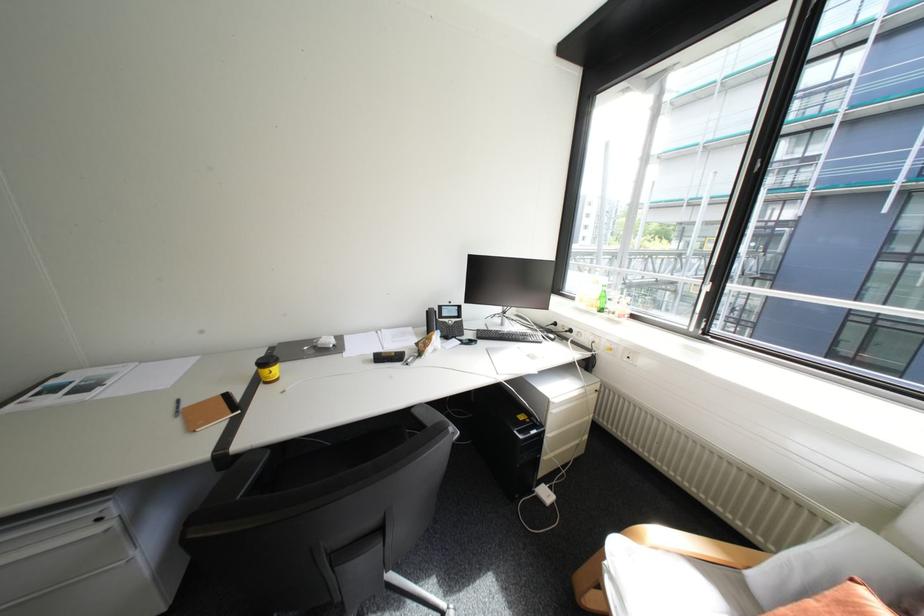
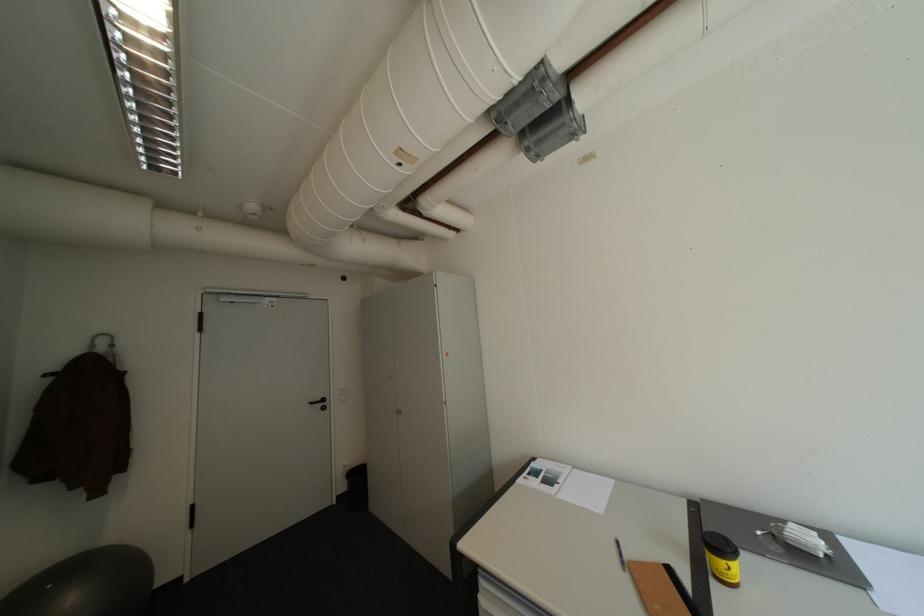
The point at (186, 416) is marked in the first image. Where is the corresponding point in the second image?

(634, 570)